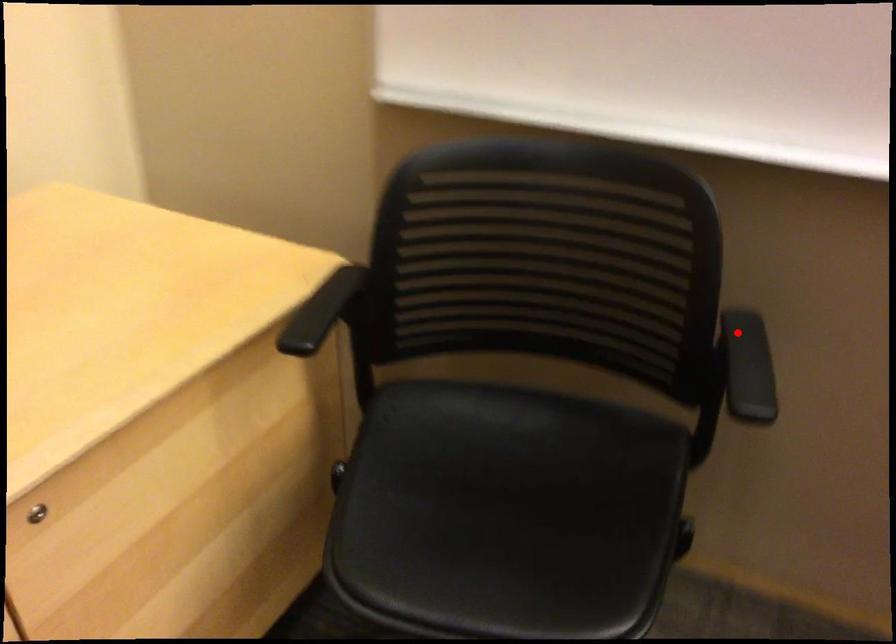
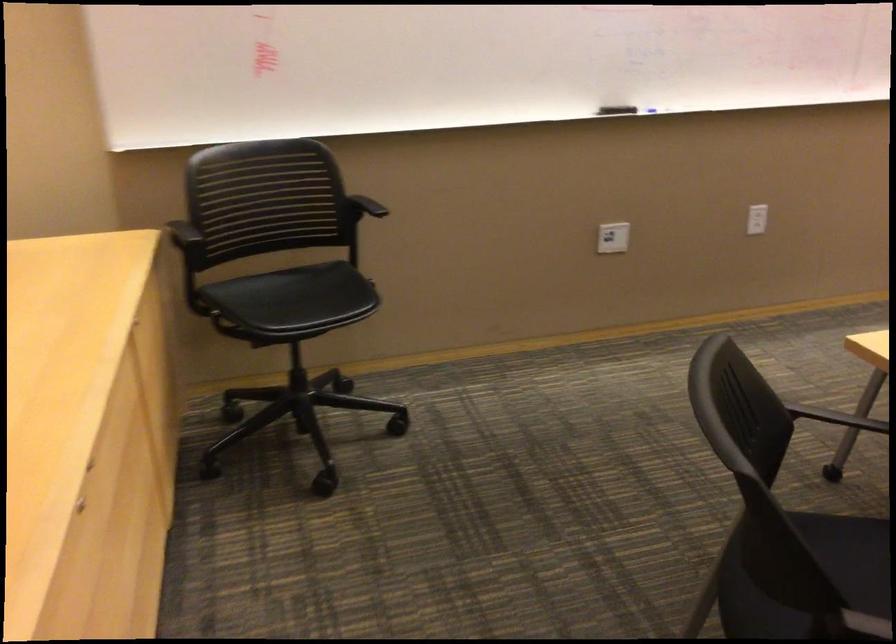
Where in the second image is the point corresponding to the highlighted location from the first image?

(366, 205)